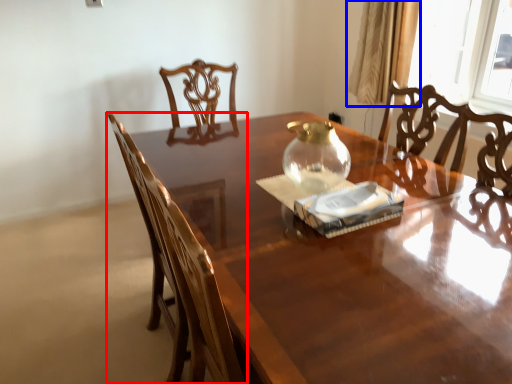
Question: Which object is closer to the camera taking this photo, chair (highlighted by a red box) or curtain (highlighted by a blue box)?

Choices:
 (A) chair
 (B) curtain

Answer: (A)